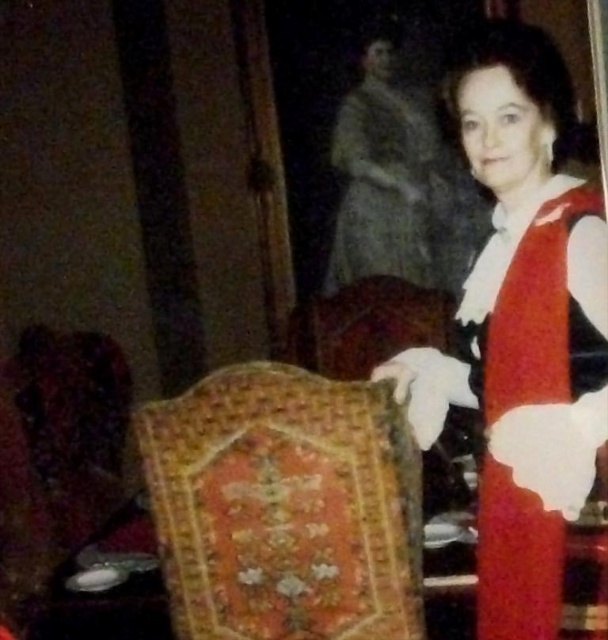
From the picture: Based on the scene described, can you determine if the matte red dress at right is closer to the camera than the embroidered velvet armchair at center?

Yes, the matte red dress at right is in front of the embroidered velvet armchair at center, meaning it is closer to the camera.

From the picture: In the vintage photograph, there is a woman wearing a red dress at the right. Can you determine if the point marked at coordinates (522, 326) falls within the area of the red dress at right?

The point at coordinates (522, 326) is located at the position of the matte red dress at right, so yes, the point falls within the area of the red dress at right.